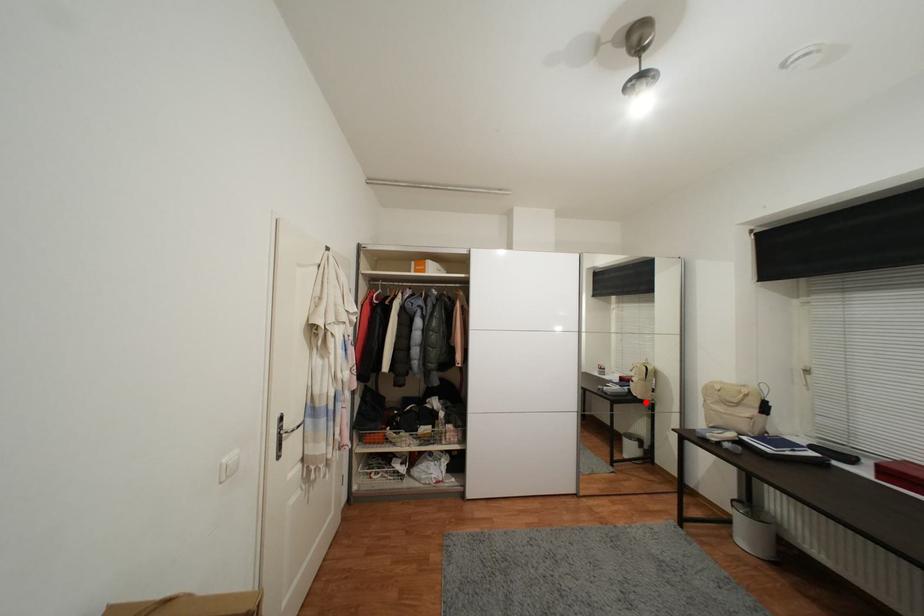
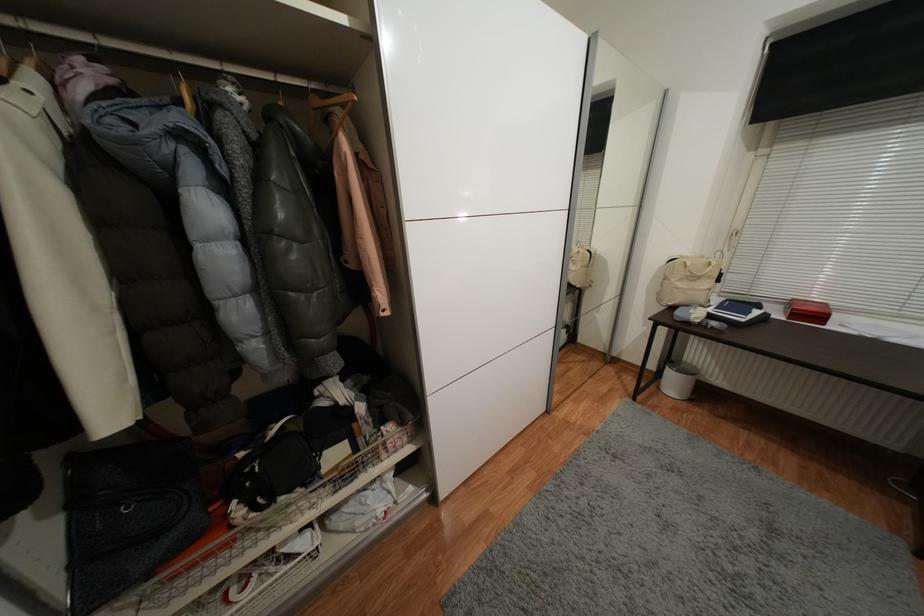
Find the pixel in the second image that matches the highlighted location in the first image.

(582, 291)